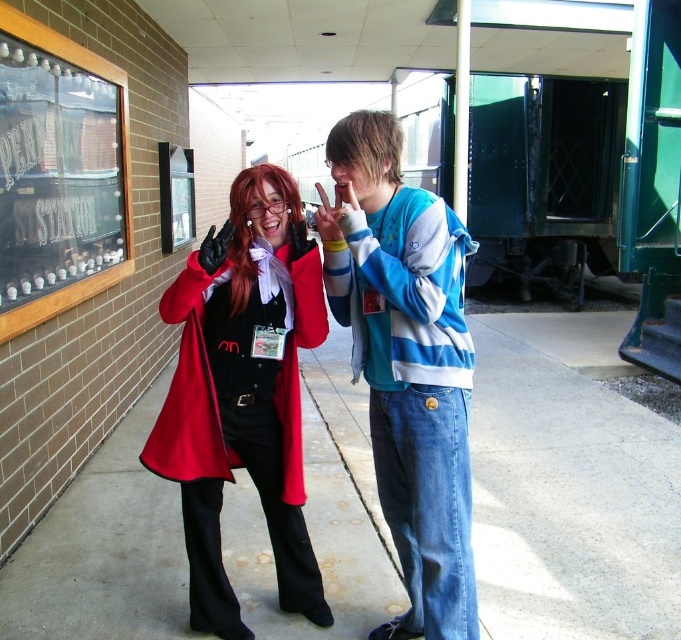
This screenshot has height=640, width=681. Describe the element at coordinates (407, 364) in the screenshot. I see `blue striped hoodie at center` at that location.

Based on the photo, is blue striped hoodie at center taller than wooden frame signboard at upper left?

Correct, blue striped hoodie at center is much taller as wooden frame signboard at upper left.

Which is in front, point (419, 484) or point (57, 301)?

Point (419, 484) is more forward.

This screenshot has height=640, width=681. I want to click on blue striped hoodie at center, so click(407, 364).

Who is lower down, smooth concrete pavement at center or matte red coat at center?

Positioned lower is smooth concrete pavement at center.

Image resolution: width=681 pixels, height=640 pixels. In order to click on smooth concrete pavement at center in this screenshot , I will do `click(569, 499)`.

Is matte red coat at center above wooden frame signboard at upper left?

No, matte red coat at center is not above wooden frame signboard at upper left.

Is matte red coat at center taller than wooden frame signboard at upper left?

No.

The height and width of the screenshot is (640, 681). I want to click on matte red coat at center, so click(x=242, y=392).

At what (x,y) coordinates should I click in order to perform the action: click on matte red coat at center. Please return your answer as a coordinate pair (x, y). The height and width of the screenshot is (640, 681). Looking at the image, I should click on (242, 392).